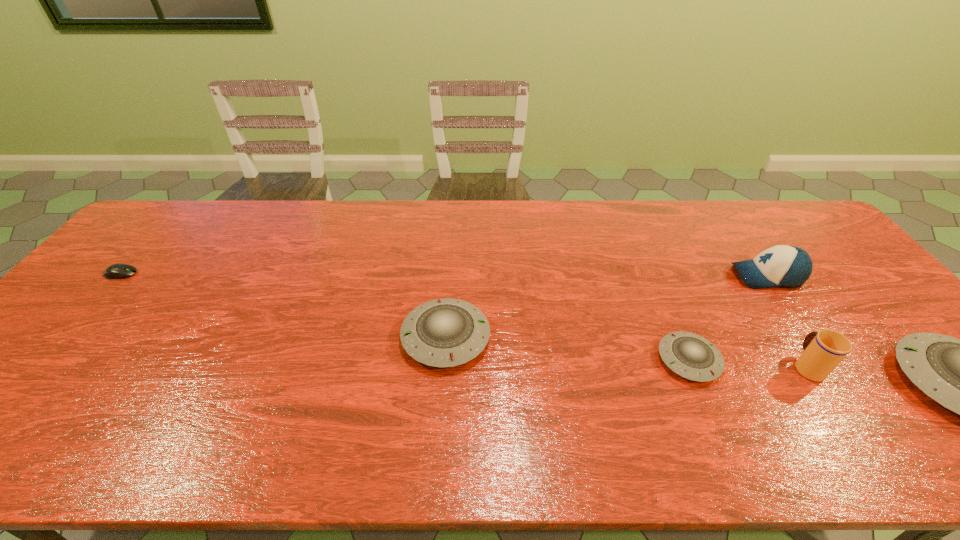
Identify the location of saucer that is the closest to the shortest saucer. (959, 374).

This screenshot has height=540, width=960. I want to click on the closest saucer to the shortest saucer, so click(x=959, y=374).

At what (x,y) coordinates should I click in order to perform the action: click on free location that satisfies the following two spatial constraints: 1. on the wheel side of the second tallest saucer; 2. on the left side of the leftmost object. Please return your answer as a coordinate pair (x, y). Looking at the image, I should click on (65, 337).

The height and width of the screenshot is (540, 960). In order to click on free space that satisfies the following two spatial constraints: 1. on the wheel side of the leftmost object; 2. on the back side of the second shortest object in this screenshot , I will do `click(46, 360)`.

You are a GUI agent. You are given a task and a screenshot of the screen. Output one action in this format:
    pyautogui.click(x=<x>, y=<y>)
    Task: Click on the vacant region that satisfies the following two spatial constraints: 1. on the wheel side of the shortest saucer; 2. on the right side of the shortest object
    Image resolution: width=960 pixels, height=540 pixels.
    Given the screenshot: What is the action you would take?
    pyautogui.click(x=46, y=360)